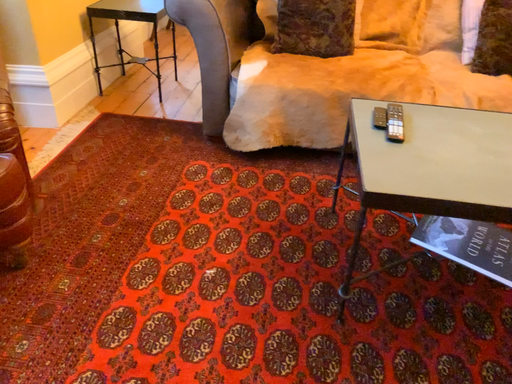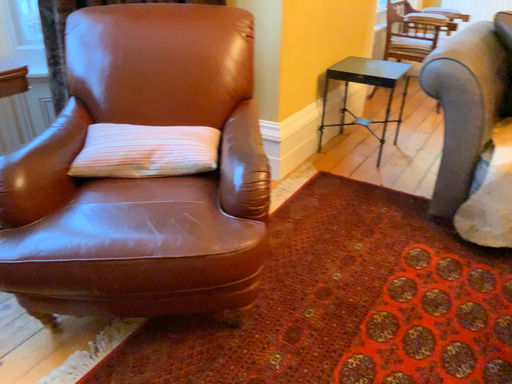
Question: How did the camera likely rotate when shooting the video?

Choices:
 (A) rotated downward
 (B) rotated upward

Answer: (B)